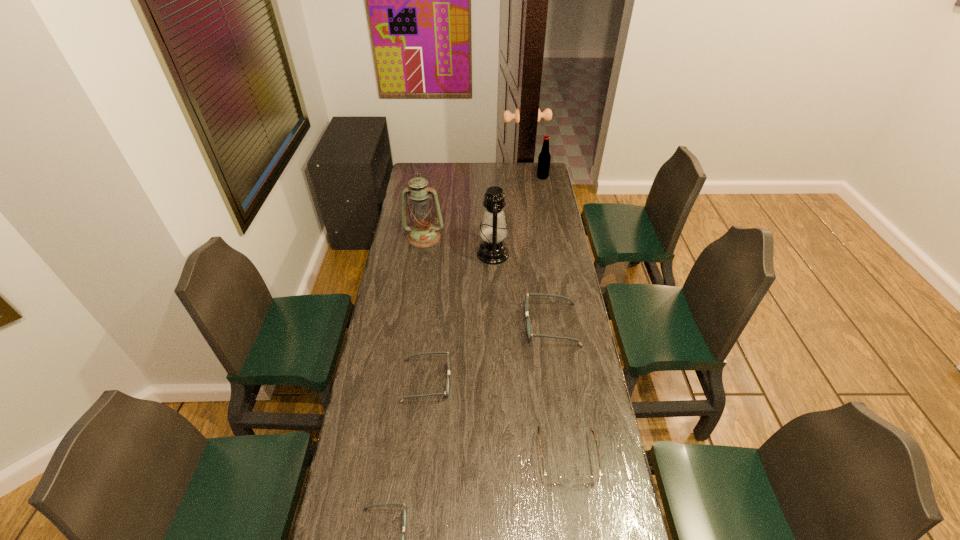
Identify the location of the sixth farthest object. This screenshot has width=960, height=540. (555, 480).

I want to click on free location located 0.250m on the back of the fourth object from left to right, so click(x=492, y=211).

This screenshot has height=540, width=960. I want to click on vacant space located on the back of the left oil lamp, so click(x=428, y=210).

Where is `free space located 0.120m on the front of the beer bottle`? The width and height of the screenshot is (960, 540). free space located 0.120m on the front of the beer bottle is located at coordinates tap(545, 192).

At what (x,y) coordinates should I click in order to perform the action: click on vacant space located on the face of the farthest spectacles. Please return your answer as a coordinate pair (x, y). The height and width of the screenshot is (540, 960). Looking at the image, I should click on (474, 325).

Locate an element on the screen. The width and height of the screenshot is (960, 540). free space located on the face of the farthest spectacles is located at coordinates (457, 325).

Identify the location of vacant space located on the face of the farthest spectacles. (437, 325).

Locate an element on the screen. The image size is (960, 540). free region located on the face of the third nearest object is located at coordinates (470, 381).

Identify the location of free space located 0.050m on the front-facing side of the third farthest spectacles. The height and width of the screenshot is (540, 960). click(x=574, y=505).

Where is `object present at the far edge`? The height and width of the screenshot is (540, 960). object present at the far edge is located at coordinates (544, 158).